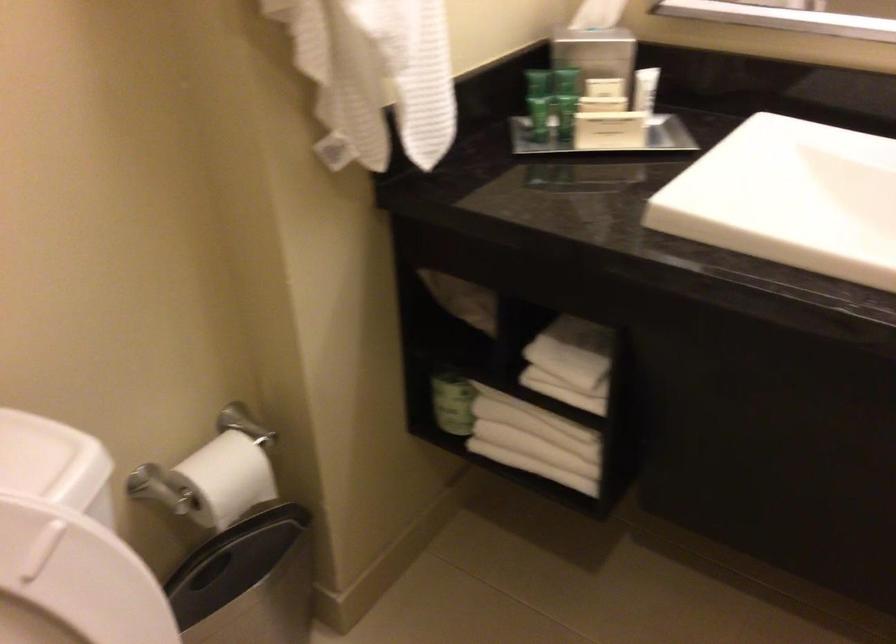
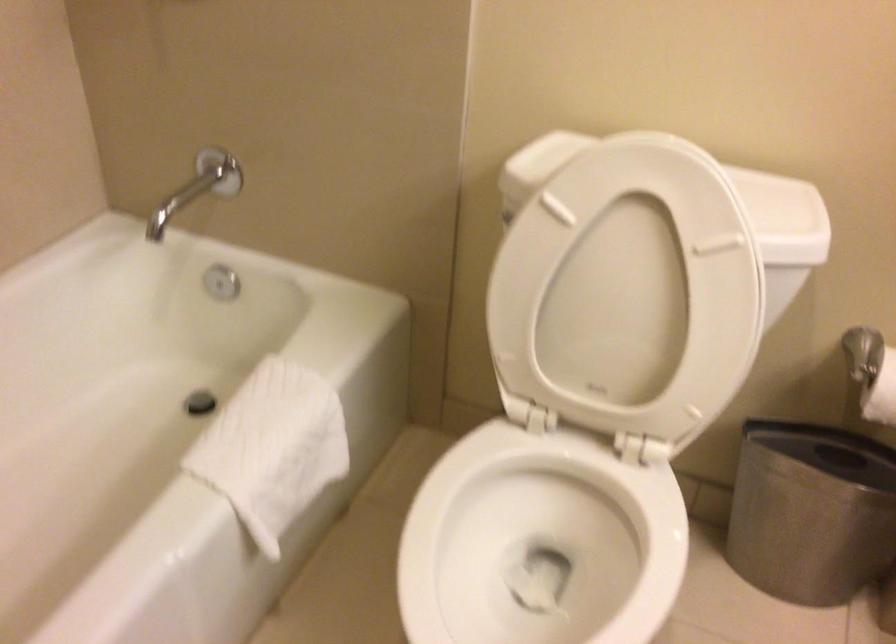
Locate, in the second image, the point that corresponds to the point at 220,506 in the first image.

(881, 393)